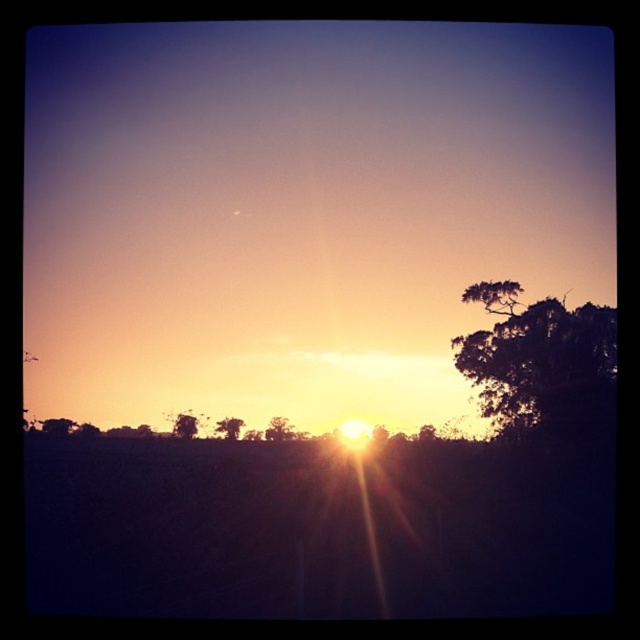
You are an artist planning to paint the sunset scene. You want to ensure the green leafy tree at center and brown textured tree at center are proportionally accurate. Which tree should you make wider in your painting?

The green leafy tree at center should be made wider in the painting since its width surpasses that of the brown textured tree at center according to the description.

You are an observer looking at the sunset scene. You notice the dark green leafy tree at right and the green leafy tree at center. Which tree appears closer to you?

The dark green leafy tree at right appears closer to you because it is further to the viewer than the green leafy tree at center.